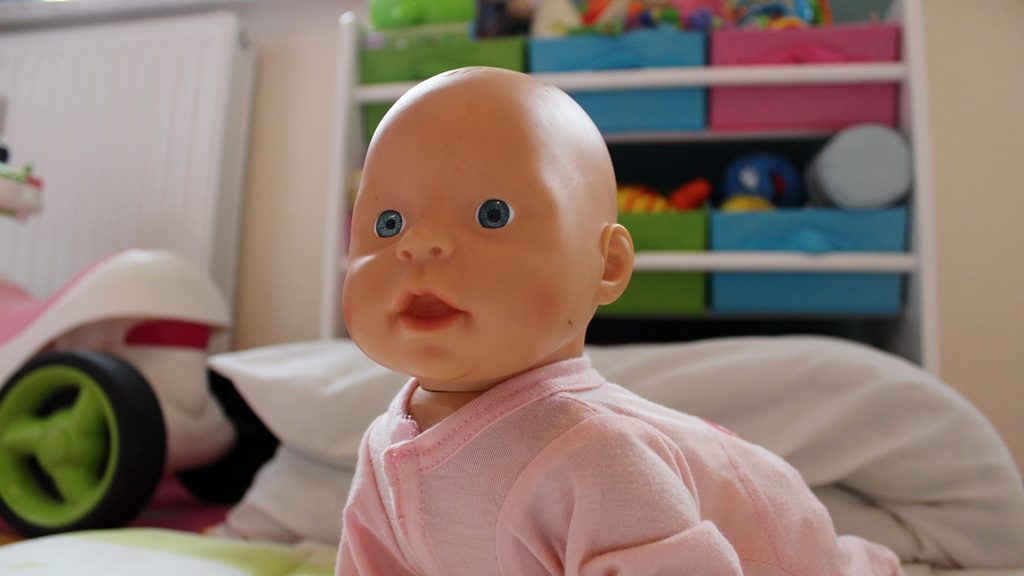
Identify the location of plastic baby doll. The image size is (1024, 576). (540, 324).